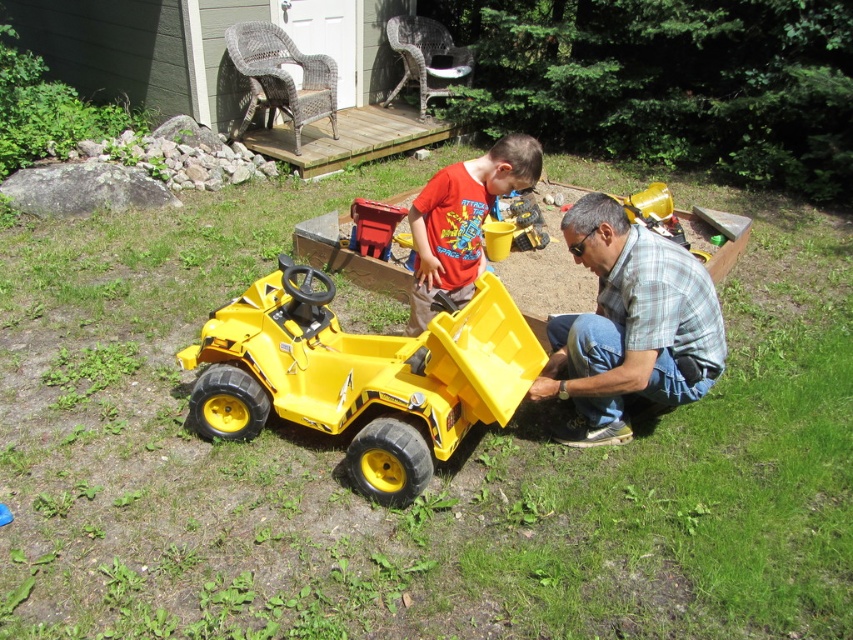
Which is more to the right, yellow plastic toy car at center or matte red shirt at center?

matte red shirt at center is more to the right.

Who is more forward, (302,312) or (496,152)?

Point (302,312) is in front.

Which is in front, point (514, 340) or point (531, 164)?

Point (514, 340) is more forward.

Locate an element on the screen. Image resolution: width=853 pixels, height=640 pixels. yellow plastic toy car at center is located at coordinates (360, 376).

Between point (677, 298) and point (422, 216), which one is positioned in front?

Point (677, 298) is more forward.

Who is taller, plaid shirt at lower right or matte red shirt at center?

With more height is plaid shirt at lower right.

The width and height of the screenshot is (853, 640). I want to click on plaid shirt at lower right, so click(x=630, y=326).

Who is shorter, yellow plastic toy car at center or plaid shirt at lower right?

yellow plastic toy car at center is shorter.

Does yellow plastic toy car at center have a smaller size compared to plaid shirt at lower right?

Actually, yellow plastic toy car at center might be larger than plaid shirt at lower right.

Locate an element on the screen. yellow plastic toy car at center is located at coordinates (360, 376).